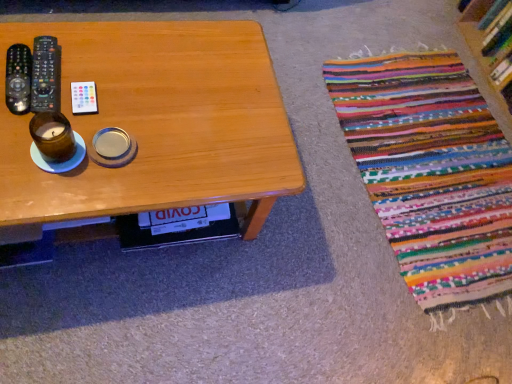
Image resolution: width=512 pixels, height=384 pixels. Identify the location of free space below multicolored woven rug at lower right (from a real-world perspective). (432, 160).